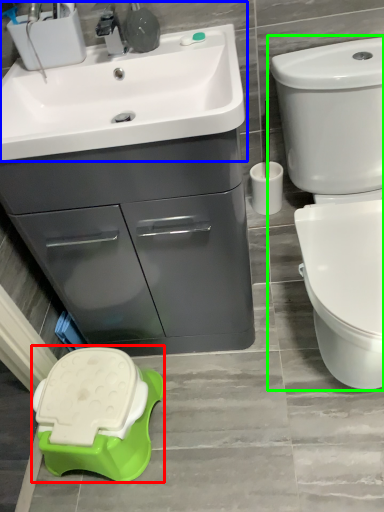
Question: Which object is positioned farthest from porcelain (highlighted by a red box)? Select from sink (highlighted by a blue box) and toilet (highlighted by a green box).

Choices:
 (A) sink
 (B) toilet

Answer: (A)